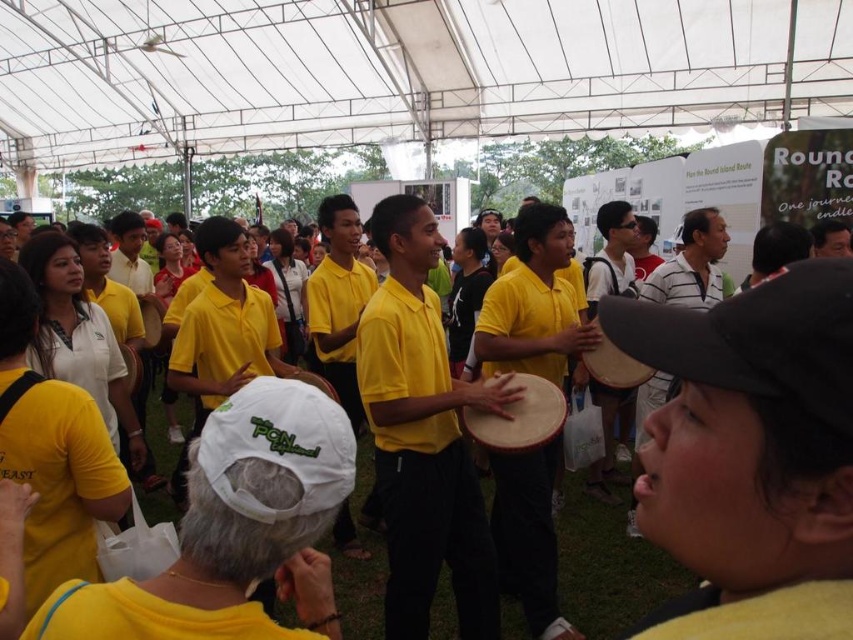
You are a photographer standing at the edge of the crowd at this outdoor event. You want to take a photo of the yellow matte shirt at center and the wooden drum at center together in the frame. If your camera has a maximum focus range of 1.5 meters, will both objects be in focus?

The yellow matte shirt at center is 1.31 meters from the wooden drum at center. Since the distance between them is within the camera maximum focus range of 1.5 meters, both objects will be in focus.

What object is located at the coordinates point (608, 568)?

The yellow matte shirt at center is located at point (608, 568).

You are at the event and want to find the person wearing the yellow matte shirt at center. What are the coordinates of this person?

The yellow matte shirt at center is located at coordinates point [608,568].